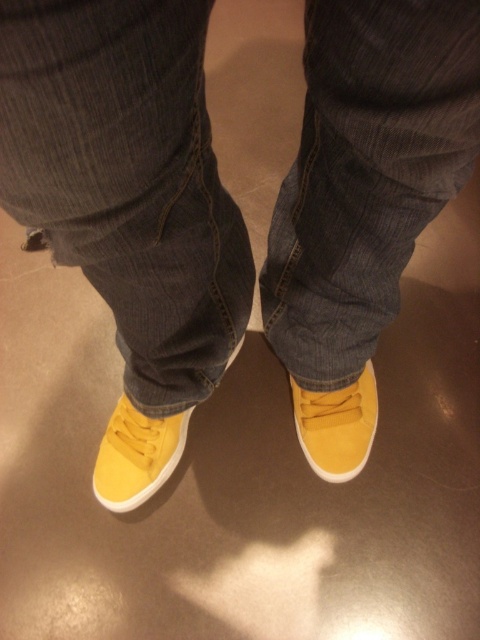
Question: Can you confirm if denim at center is positioned below yellow suede shoe at lower center?

Choices:
 (A) no
 (B) yes

Answer: (A)

Question: Can you confirm if denim at center is positioned to the right of yellow suede shoe at lower center?

Choices:
 (A) yes
 (B) no

Answer: (B)

Question: Which of the following is the closest to the observer?

Choices:
 (A) denim at center
 (B) yellow suede shoe at lower center

Answer: (A)

Question: Among these objects, which one is farthest from the camera?

Choices:
 (A) yellow suede shoe at lower center
 (B) denim at center

Answer: (A)

Question: Which object appears farthest from the camera in this image?

Choices:
 (A) matte yellow sneaker at lower left
 (B) denim at center
 (C) yellow suede shoe at lower center

Answer: (C)

Question: Does matte yellow sneaker at lower left appear under yellow suede shoe at lower center?

Choices:
 (A) no
 (B) yes

Answer: (B)